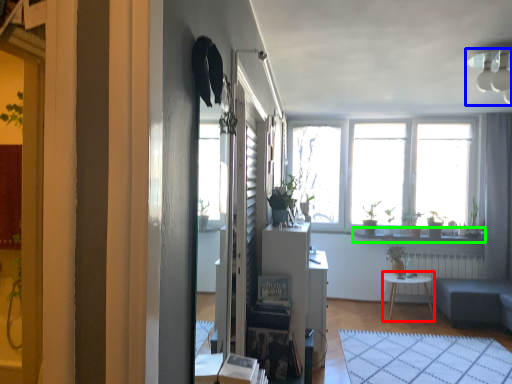
Question: Which object is the closest to the desk (highlighted by a red box)? Choose among these: lamp (highlighted by a blue box) or window sill (highlighted by a green box).

Choices:
 (A) lamp
 (B) window sill

Answer: (B)